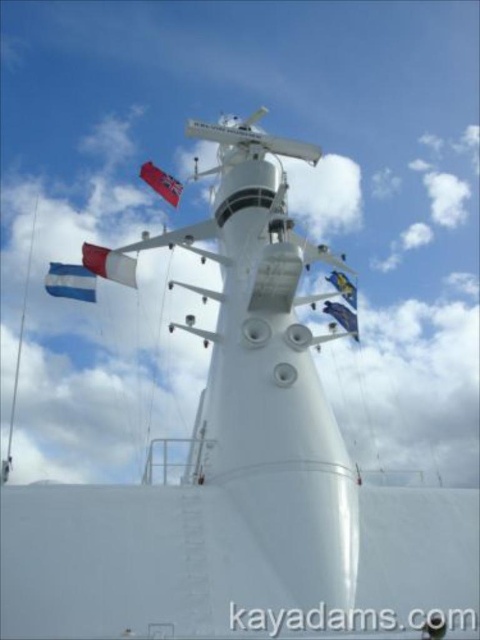
The height and width of the screenshot is (640, 480). Describe the element at coordinates (109, 262) in the screenshot. I see `white fabric flag at center` at that location.

Between point (98, 259) and point (324, 310), which one is positioned behind?

Point (98, 259)

The image size is (480, 640). In order to click on white fabric flag at center in this screenshot , I will do `click(109, 262)`.

Can you confirm if white fabric flag at center is positioned to the right of blue fabric flag at upper right?

In fact, white fabric flag at center is to the left of blue fabric flag at upper right.

Can you confirm if white fabric flag at center is bigger than blue fabric flag at upper right?

Yes, white fabric flag at center is bigger than blue fabric flag at upper right.

Does point (123, 260) lie in front of point (340, 291)?

Yes, it is.

You are a GUI agent. You are given a task and a screenshot of the screen. Output one action in this format:
    pyautogui.click(x=<x>, y=<y>)
    Task: Click on the white fabric flag at center
    This screenshot has height=640, width=480.
    Given the screenshot: What is the action you would take?
    pyautogui.click(x=109, y=262)

Is blue fabric flag at left thinner than blue fabric flag at upper right?

Incorrect, blue fabric flag at left's width is not less than blue fabric flag at upper right's.

Is point (85, 289) positioned before point (348, 300)?

Yes, point (85, 289) is in front of point (348, 300).

The height and width of the screenshot is (640, 480). What do you see at coordinates (71, 282) in the screenshot?
I see `blue fabric flag at left` at bounding box center [71, 282].

Find the location of a particular element. The image size is (480, 640). blue fabric flag at left is located at coordinates (71, 282).